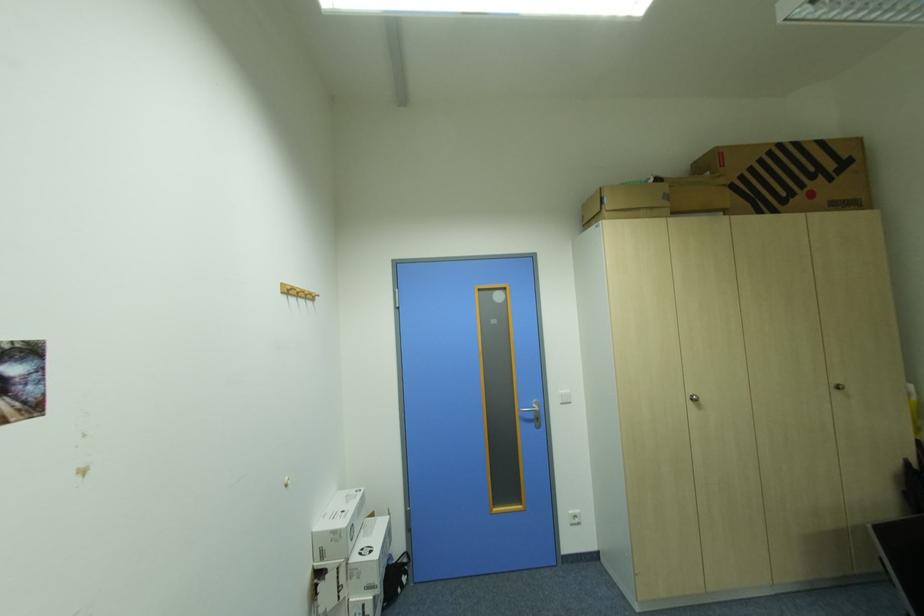
What do you see at coordinates (531, 410) in the screenshot? This screenshot has width=924, height=616. I see `the silver door handle` at bounding box center [531, 410].